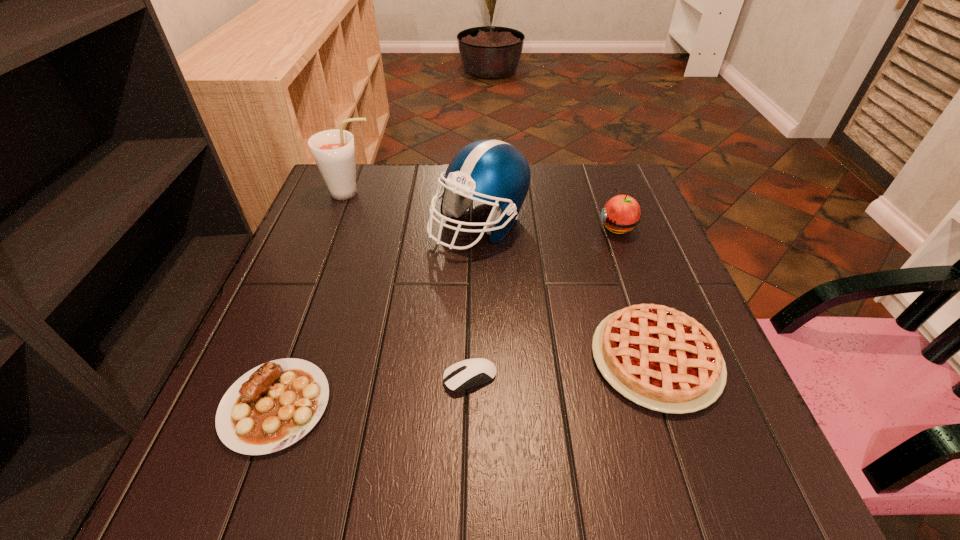
I want to click on object that is at the near left corner, so click(x=274, y=405).

In the image, there is a desktop. Where is `vacant space at the far edge`? The height and width of the screenshot is (540, 960). vacant space at the far edge is located at coordinates (544, 183).

Locate an element on the screen. The image size is (960, 540). blank space at the near edge of the desktop is located at coordinates (314, 461).

Locate an element on the screen. The image size is (960, 540). vacant region at the left edge of the desktop is located at coordinates (304, 287).

What are the coordinates of `free space at the near left corner of the desktop` in the screenshot? It's located at (209, 464).

The width and height of the screenshot is (960, 540). I want to click on free space at the near right corner of the desktop, so click(x=754, y=474).

Locate an element on the screen. vacant point located between the third shortest object and the root beer is located at coordinates (503, 276).

Where is `empty space that is in between the third tallest object and the mouse`? The height and width of the screenshot is (540, 960). empty space that is in between the third tallest object and the mouse is located at coordinates (543, 302).

Identify the location of unoccupied position between the fourth shortest object and the pie. Image resolution: width=960 pixels, height=540 pixels. (636, 293).

This screenshot has height=540, width=960. I want to click on free space between the steak and the fourth shortest object, so click(x=446, y=316).